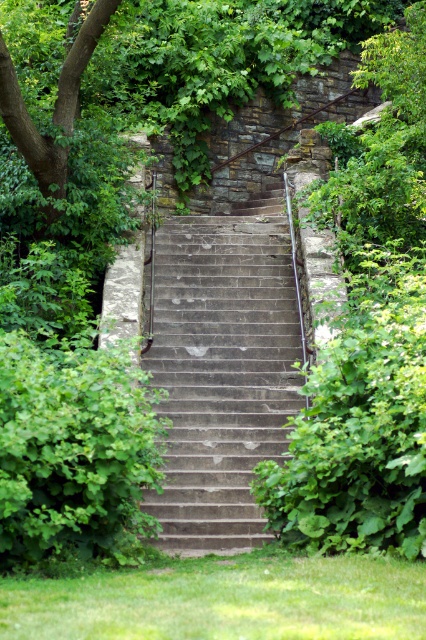
You are standing at the bottom of the gray concrete stairs at center and want to reach the green leafy tree at upper left. Which direction should you move towards?

You should move to the left since the gray concrete stairs at center are to the right of the green leafy tree at upper left, meaning the tree is on the left side relative to the stairs.

You are standing at the bottom of the gray concrete stairs at center and want to reach the green leafy tree at upper left. Which direction should you walk to get closer to the tree?

You should walk upwards along the gray concrete stairs at center because they lead towards the green leafy tree at upper left, which is located above the stairs.

You are standing at the bottom of the gray concrete stairs at center. If you move forward in the direction the stairs are facing, where will you end up?

Moving forward in the direction the gray concrete stairs at center are facing will lead you upwards towards the stone wall at the top.